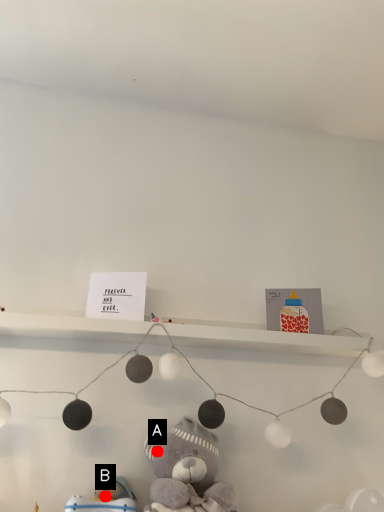
Question: Two points are circled on the image, labeled by A and B beside each circle. Which point appears closest to the camera in this image?

Choices:
 (A) A is closer
 (B) B is closer

Answer: (B)